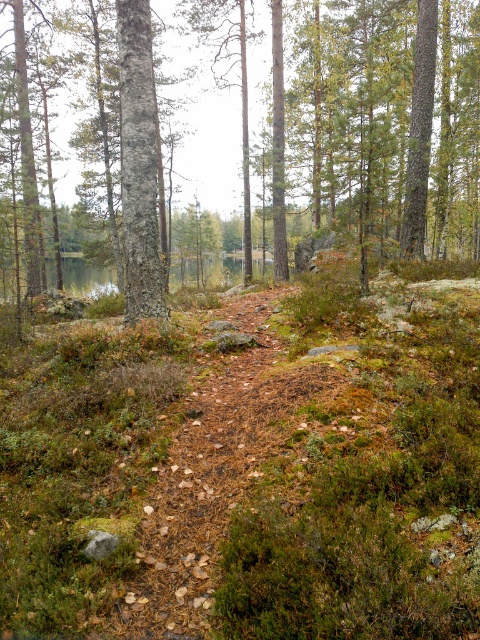
What do you see at coordinates (375, 131) in the screenshot?
I see `brown bark tree at center` at bounding box center [375, 131].

Who is positioned more to the right, brown bark tree at center or smooth gray bark tree at center?

Positioned to the right is smooth gray bark tree at center.

Which is behind, point (294, 209) or point (136, 86)?

Positioned behind is point (294, 209).

Where is `brown bark tree at center`? This screenshot has height=640, width=480. brown bark tree at center is located at coordinates (375, 131).

Between point (128, 19) and point (191, 262), which one is positioned behind?

Positioned behind is point (191, 262).

Where is `smooth gray bark tree at center`? Image resolution: width=480 pixels, height=640 pixels. smooth gray bark tree at center is located at coordinates (139, 163).

Where is `smooth gray bark tree at center`? smooth gray bark tree at center is located at coordinates (139, 163).

Who is shorter, brown bark tree at center or green mossy lake at center?

green mossy lake at center is shorter.

Can you confirm if brown bark tree at center is thinner than green mossy lake at center?

No.

I want to click on brown bark tree at center, so click(375, 131).

I want to click on brown bark tree at center, so 375,131.